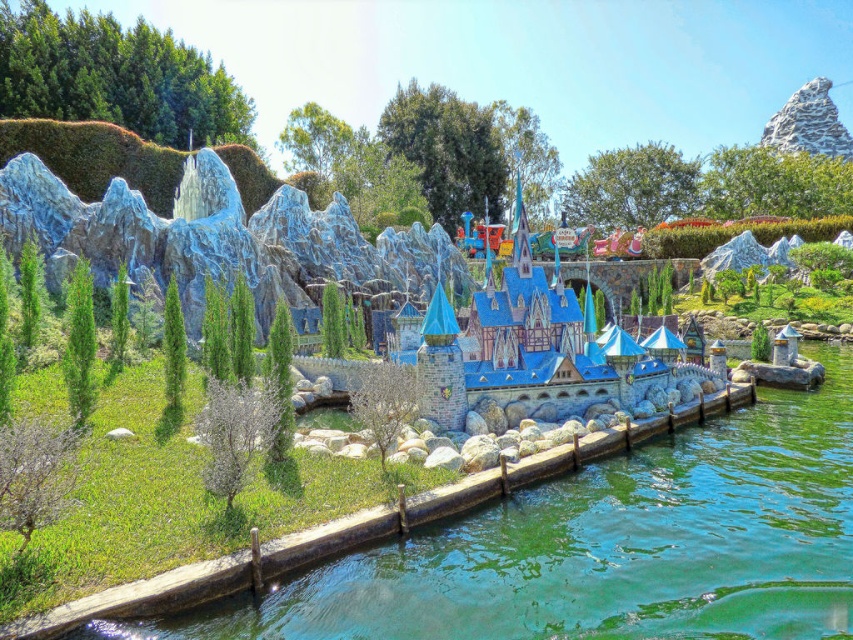
You are a visitor at the theme park and want to take a photo of both the green leafy tree at upper right and the green fuzzy bush at lower left. Which object should you position closer to the right side of your camera frame?

The green leafy tree at upper right should be positioned closer to the right side of your camera frame because it is located on the right side of the green fuzzy bush at lower left.